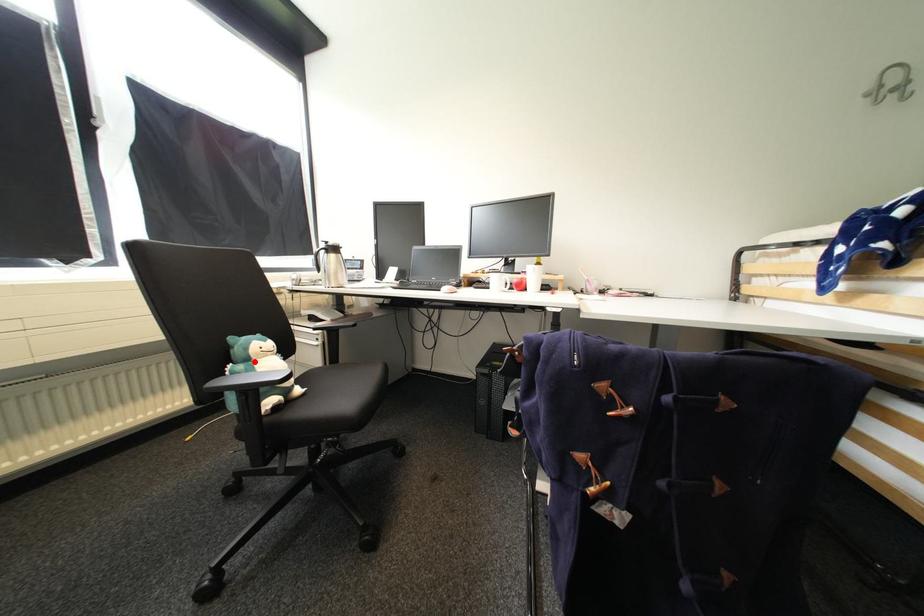
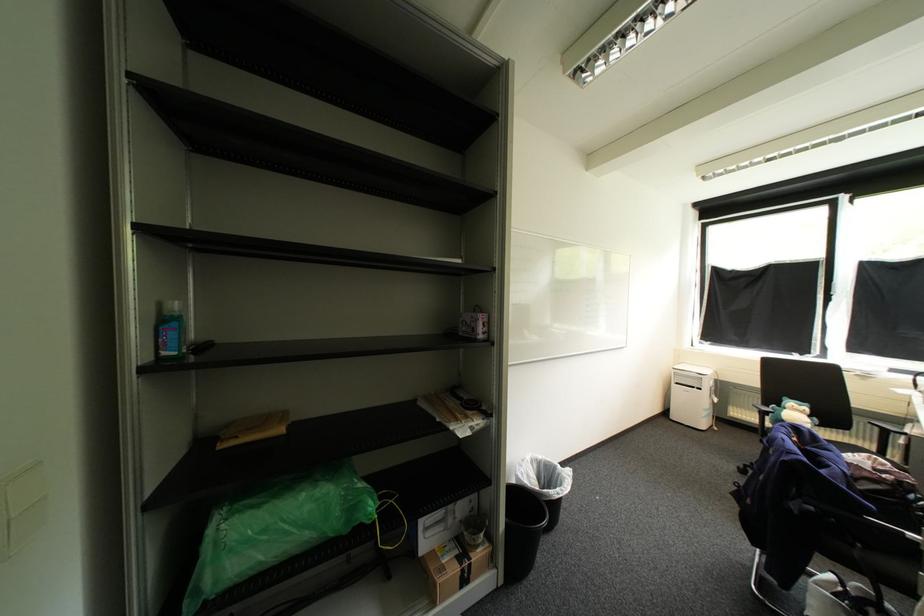
Locate, in the second image, the point that corresponds to the highlighted location in the first image.

(792, 408)